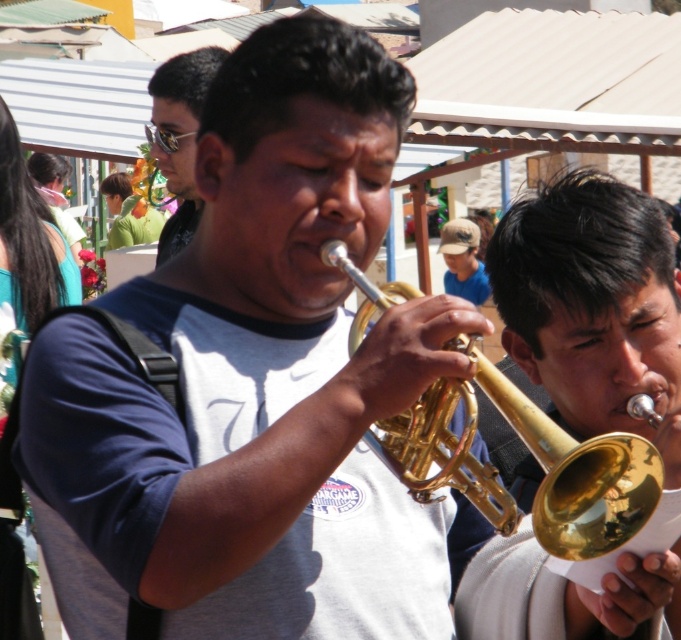
Question: Does gold brass trombone at center have a larger size compared to matte black sunglasses at upper left?

Choices:
 (A) yes
 (B) no

Answer: (A)

Question: Which object is positioned farthest from the gold shiny trumpet at right?

Choices:
 (A) matte black sunglasses at upper left
 (B) gold brass trombone at center

Answer: (A)

Question: Which of the following is the farthest from the observer?

Choices:
 (A) gold shiny trumpet at right
 (B) matte black sunglasses at upper left

Answer: (B)

Question: Is gold shiny trumpet at right smaller than gold brass trombone at center?

Choices:
 (A) no
 (B) yes

Answer: (B)

Question: Estimate the real-world distances between objects in this image. Which object is closer to the matte black sunglasses at upper left?

Choices:
 (A) gold brass trombone at center
 (B) gold shiny trumpet at right

Answer: (B)

Question: Is gold brass trombone at center to the left of matte black sunglasses at upper left from the viewer's perspective?

Choices:
 (A) yes
 (B) no

Answer: (B)